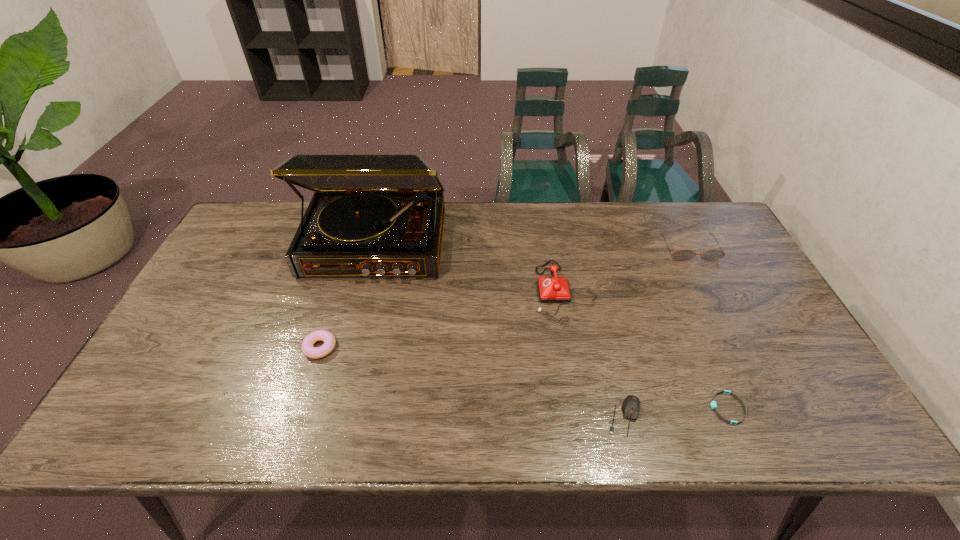
In order to click on free location located on the dial of the telephone in this screenshot , I will do click(468, 292).

Identify the location of vacant space located on the face of the third tallest object. Image resolution: width=960 pixels, height=540 pixels. (701, 272).

The image size is (960, 540). What are the coordinates of `free region located on the front of the doughnut` in the screenshot? It's located at (306, 393).

Locate an element on the screen. blank area located 0.070m on the left of the fifth tallest object is located at coordinates (575, 416).

What are the coordinates of `vacant space located on the buckle of the wristband` in the screenshot? It's located at [x=659, y=408].

This screenshot has width=960, height=540. I want to click on vacant area located on the buckle of the wristband, so click(x=614, y=408).

Locate an element on the screen. free space located 0.300m on the buckle of the wristband is located at coordinates (580, 408).

Locate an element on the screen. This screenshot has height=540, width=960. record player located in the far edge section of the desktop is located at coordinates (371, 215).

I want to click on sunglasses at the far edge, so click(681, 255).

I want to click on mouse that is at the near edge, so click(631, 404).